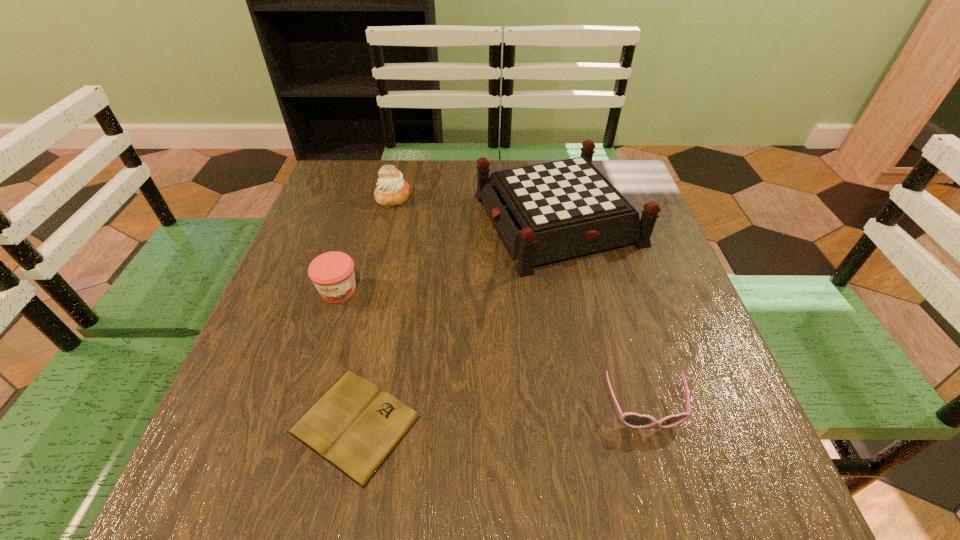
You are a GUI agent. You are given a task and a screenshot of the screen. Output one action in this format:
    pyautogui.click(x=<x>, y=<y>)
    Task: Click on the object situated at the far right corner
    This screenshot has width=960, height=540.
    Given the screenshot: What is the action you would take?
    pyautogui.click(x=546, y=212)

This screenshot has width=960, height=540. What are the coordinates of `free space at the far edge of the desktop` in the screenshot? It's located at (479, 205).

The height and width of the screenshot is (540, 960). I want to click on vacant space at the near edge of the desktop, so click(x=440, y=478).

This screenshot has width=960, height=540. I want to click on blank space at the left edge of the desktop, so click(276, 295).

Find the location of a particular element. Image resolution: width=960 pixels, height=540 pixels. vacant space at the right edge is located at coordinates (688, 369).

You are a GUI agent. You are given a task and a screenshot of the screen. Output one action in this format:
    pyautogui.click(x=<x>, y=<y>)
    Task: Click on the vacant space at the far left corner of the desktop
    The height and width of the screenshot is (540, 960).
    Given the screenshot: What is the action you would take?
    pyautogui.click(x=325, y=178)

The height and width of the screenshot is (540, 960). I want to click on vacant space at the far right corner, so click(x=640, y=195).

Find the location of a particular element. This screenshot has height=540, width=960. vacant space in between the pastry and the sunglasses is located at coordinates (x=519, y=302).

Locate an element on the screen. free spot between the pastry and the book is located at coordinates pyautogui.click(x=374, y=310).

Identify the location of free space between the second shortest object and the pastry. (519, 302).